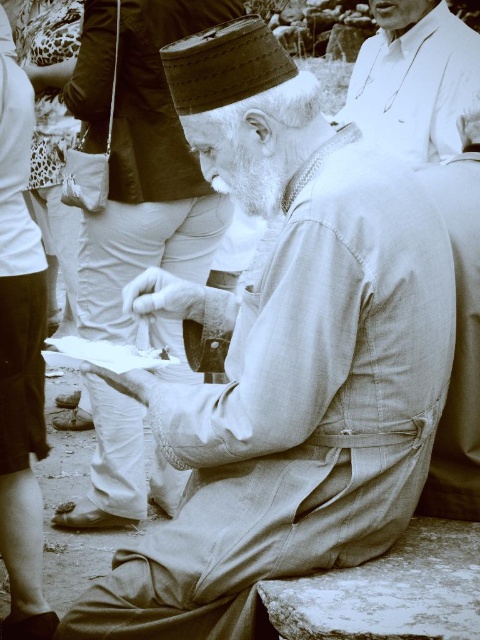
Question: Which of the following is the farthest from the observer?

Choices:
 (A) white woolen beard at center
 (B) textured fabric robe at center
 (C) white paper plate at center

Answer: (B)

Question: Which point is farther to the camera?

Choices:
 (A) textured fabric robe at center
 (B) white fabric shirt at upper right
 (C) white woolen beard at center
 (D) light beige fabric at right

Answer: (A)

Question: Can you confirm if white fabric shirt at upper right is positioned to the left of white woolen beard at center?

Choices:
 (A) yes
 (B) no

Answer: (B)

Question: Is white woolen beard at center positioned in front of white paper plate at center?

Choices:
 (A) no
 (B) yes

Answer: (B)

Question: Can you confirm if textured fabric robe at center is wider than white fabric shirt at upper right?

Choices:
 (A) yes
 (B) no

Answer: (A)

Question: Which object is closer to the camera taking this photo?

Choices:
 (A) white woolen beard at center
 (B) white fabric shirt at upper right
 (C) white paper plate at center

Answer: (A)